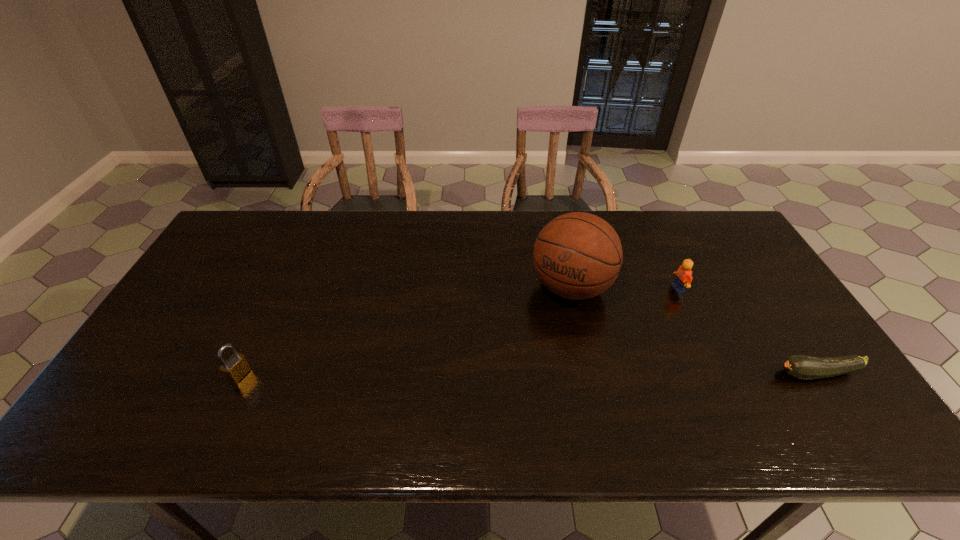
What are the coordinates of `free region located 0.110m on the side with brand label of the third object from right to left` in the screenshot? It's located at (537, 339).

At what (x,y) coordinates should I click in order to perform the action: click on free space located on the side with brand label of the third object from right to left. Please return your answer as a coordinate pair (x, y). Looking at the image, I should click on (532, 347).

This screenshot has height=540, width=960. Identify the location of blank space located 0.090m on the side with brand label of the third object from right to left. (540, 334).

Image resolution: width=960 pixels, height=540 pixels. Identify the location of free space located on the front-facing side of the third object from left to right. (589, 346).

This screenshot has width=960, height=540. I want to click on vacant space located on the front-facing side of the third object from left to right, so click(598, 341).

At what (x,y) coordinates should I click in order to perform the action: click on vacant position located on the front-facing side of the third object from left to right. Please return your answer as a coordinate pair (x, y). The width and height of the screenshot is (960, 540). Looking at the image, I should click on (660, 303).

You are a GUI agent. You are given a task and a screenshot of the screen. Output one action in this format:
    pyautogui.click(x=<x>, y=<y>)
    Task: Click on the padlock at the near edge
    The height and width of the screenshot is (540, 960).
    Given the screenshot: What is the action you would take?
    pyautogui.click(x=236, y=367)

The width and height of the screenshot is (960, 540). What are the coordinates of `zucchini that is at the near edge` in the screenshot? It's located at tap(802, 367).

At what (x,y) coordinates should I click in order to perform the action: click on object that is positioned at the right edge. Please return your answer as a coordinate pair (x, y). The height and width of the screenshot is (540, 960). Looking at the image, I should click on (802, 367).

Identify the location of object at the near right corner. (802, 367).